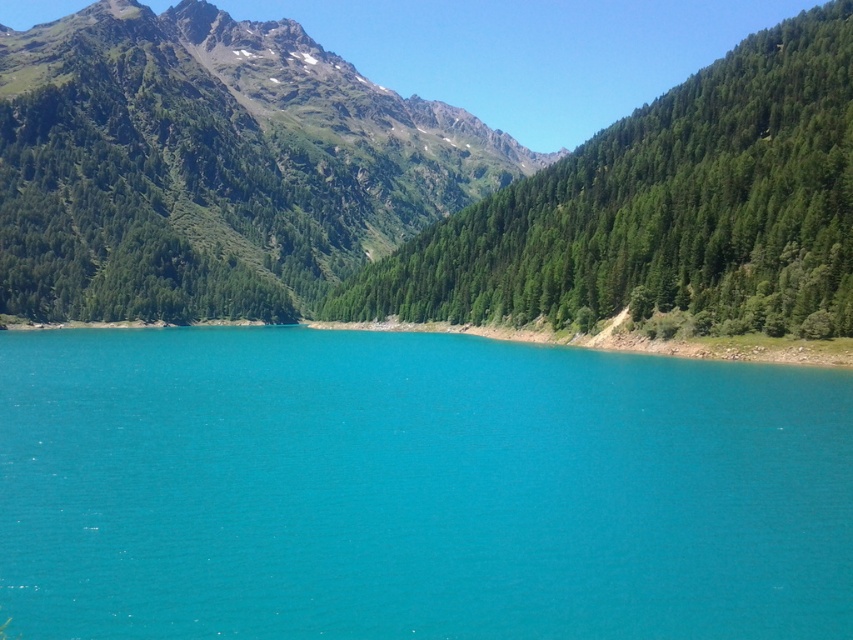
You are planning to take a photo of the green textured mountain at upper left and the green textured tree at right. Which object should you focus on first if you want to capture both in the same frame without moving the camera?

The green textured mountain at upper left is larger in size than the green textured tree at right, so you should focus on the green textured mountain at upper left first to ensure it fits properly in the frame before adjusting for the smaller tree.

Looking at this image, you are standing on the lakeshore and want to take a photo of both the turquoise water at center and the green textured mountain at upper left. Which object should you position closer to the left side of your camera frame to include both in the shot?

You should position the green textured mountain at upper left closer to the left side of your camera frame because the turquoise water at center is to the right of the green textured mountain at upper left.

In the scene shown: You are planning to take a photo of the green textured mountain at upper left and the green textured tree at right. Which object should you focus on first if you want to capture both in a single frame without moving the camera?

You should focus on the green textured mountain at upper left first because it is wider than the green textured tree at right, so it requires a wider angle to include both in the frame.